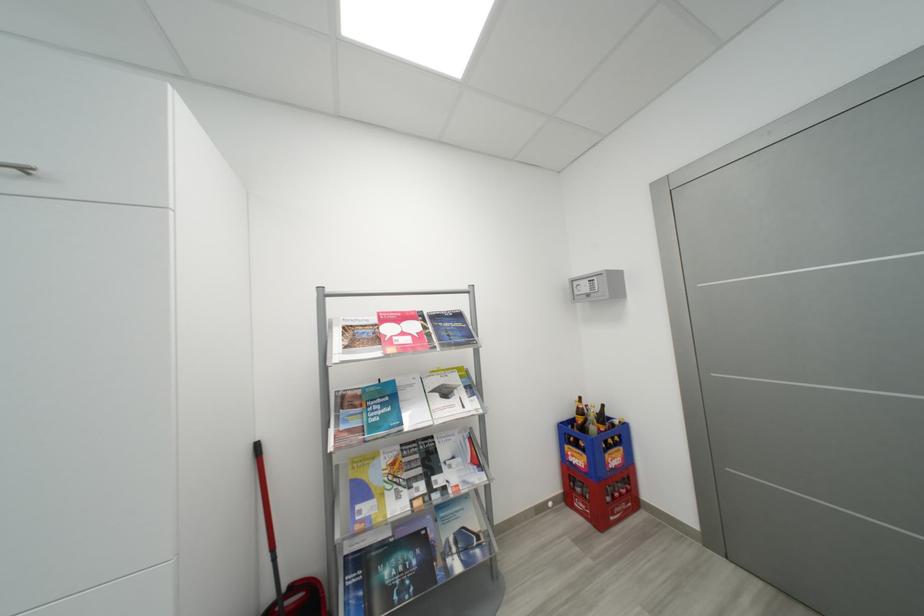
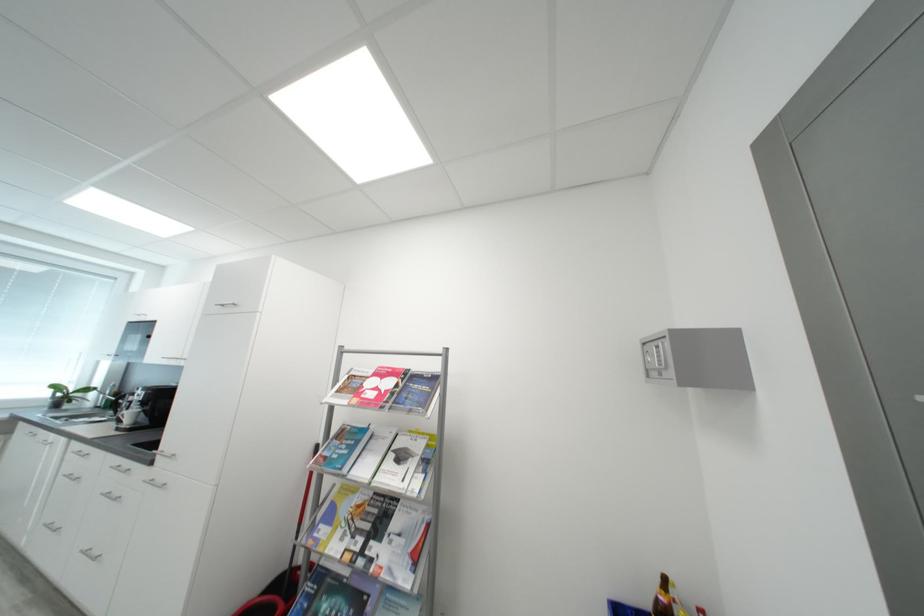
Find the pixel in the second image that matches [417,339] in the first image.

(383, 395)